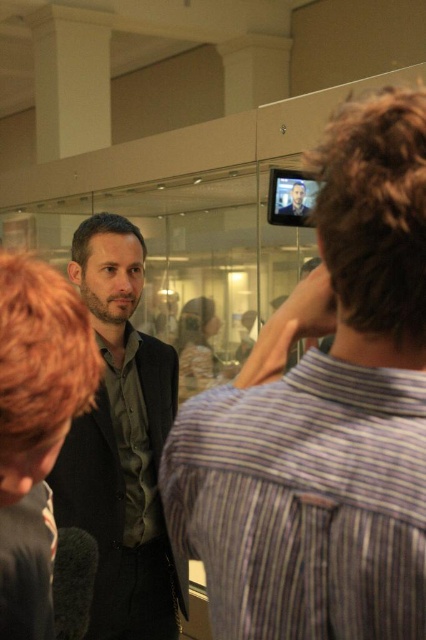
You are navigating through the space and need to reach a specific location. There are two points marked as point 1 at coordinate (347, 486) and point 2 at coordinate (293, 214). Which point is closer to you if you are facing the direction of the glass enclosure?

Point 1 at coordinate (347, 486) is closer to you because it is in front of point 2 at coordinate (293, 214) when facing the glass enclosure.

You are an event planner trying to arrange seating for a meeting. You see two people in the image, one wearing a matte black shirt at left and another with a matte black face at center. Which person is located to the left of the other?

The matte black shirt at left is positioned on the left side of the matte black face at center, so the person in the matte black shirt at left is to the left of the person with the matte black face at center.